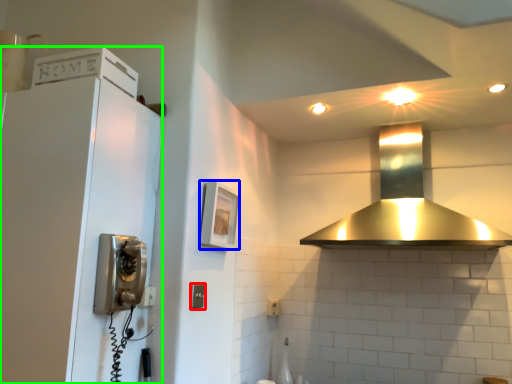
Question: Which object is the closest to the light switch (highlighted by a red box)? Choose among these: picture frame (highlighted by a blue box) or appliance (highlighted by a green box).

Choices:
 (A) picture frame
 (B) appliance

Answer: (A)